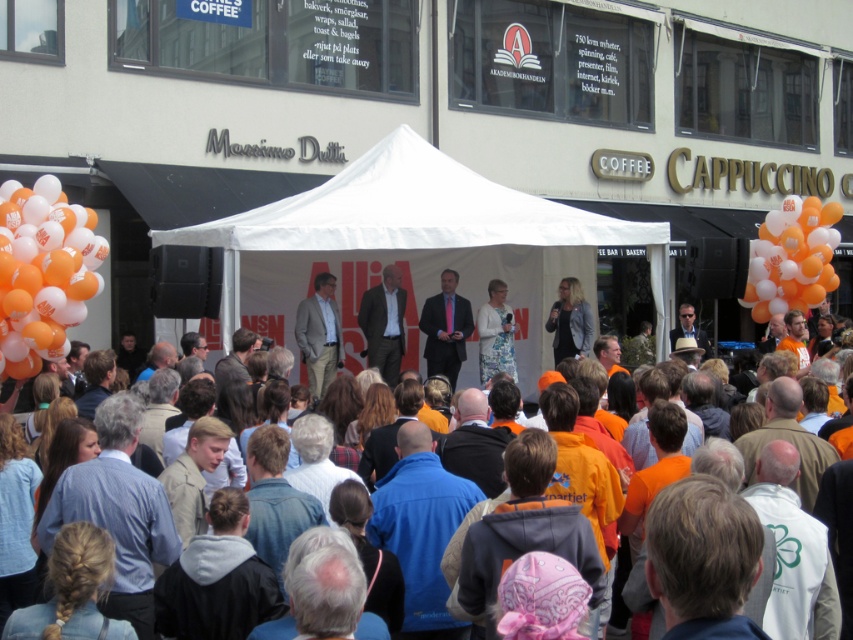
Question: Which point is farther from the camera taking this photo?

Choices:
 (A) (816, 300)
 (B) (688, 378)
 (C) (4, 289)

Answer: (A)

Question: Which is nearer to the matte black suit at center?

Choices:
 (A) matte gray suit at center
 (B) white floral dress at center

Answer: (B)

Question: Can you confirm if matte gray suit at center is wider than matte black suit at center?

Choices:
 (A) yes
 (B) no

Answer: (B)

Question: Is orange matte balloon at left to the right of gray fabric jacket at center from the viewer's perspective?

Choices:
 (A) yes
 (B) no

Answer: (B)

Question: Which of the following is the closest to the observer?

Choices:
 (A) orange matte balloons at right
 (B) orange matte balloon at left
 (C) dark gray suit at center

Answer: (B)

Question: Is orange matte balloons at right to the left of orange fabric crowd at center from the viewer's perspective?

Choices:
 (A) yes
 (B) no

Answer: (B)